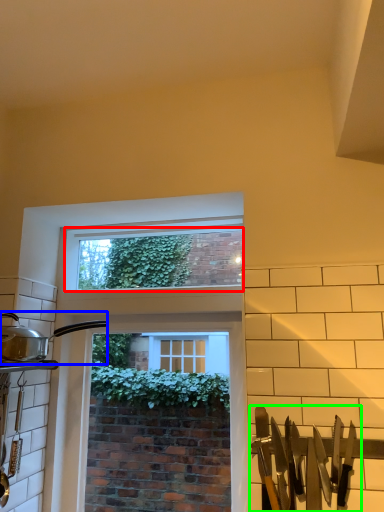
Question: Which is nearer to the window screen (highlighted by a red box)? kitchen appliance (highlighted by a blue box) or silverware (highlighted by a green box).

Choices:
 (A) kitchen appliance
 (B) silverware

Answer: (A)